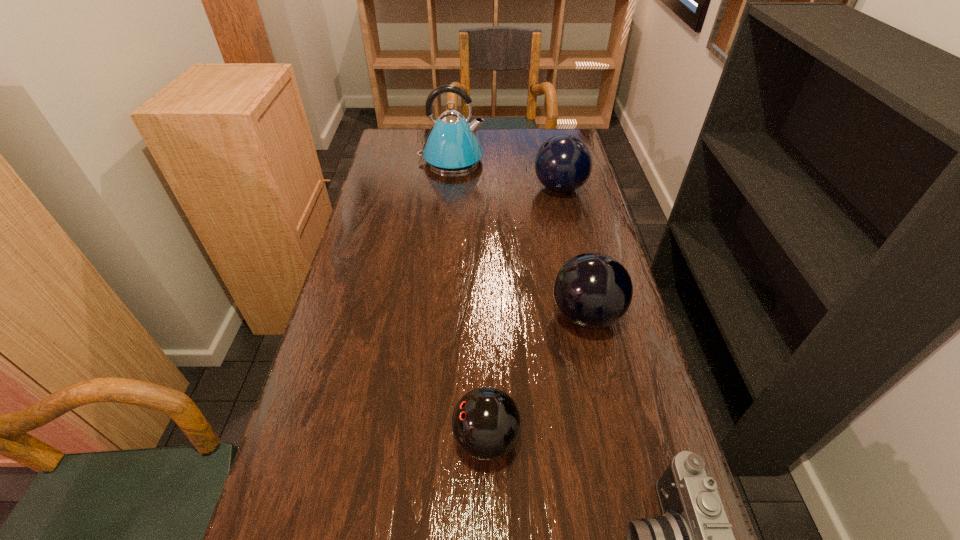
Identify the location of the closest bowling ball relative to the second nearest bowling ball. (486, 423).

The width and height of the screenshot is (960, 540). Find the location of `the second closest bowling ball relative to the farthest bowling ball`. the second closest bowling ball relative to the farthest bowling ball is located at coordinates (486, 423).